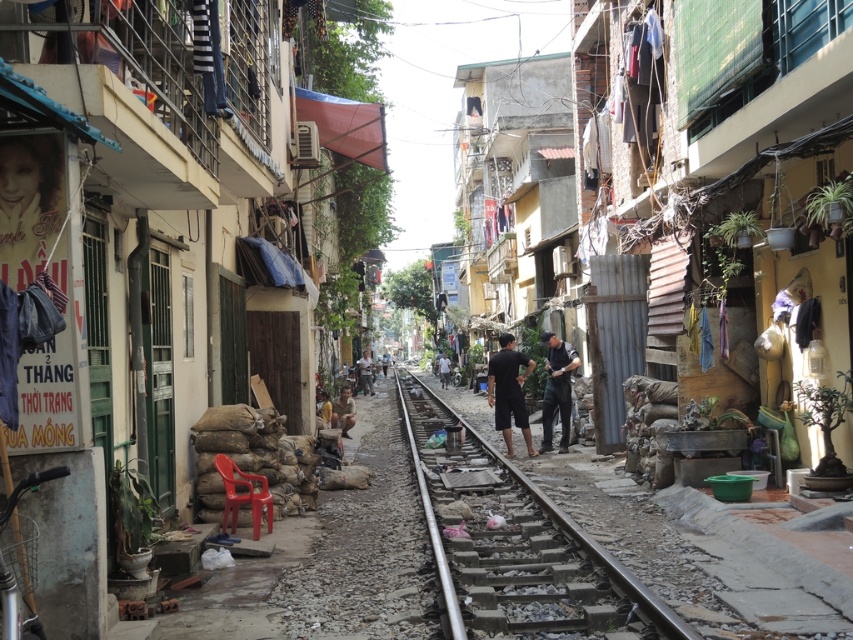
Question: Does dark blue fabric at center appear over red plastic chair at lower left?

Choices:
 (A) yes
 (B) no

Answer: (A)

Question: Among these points, which one is farthest from the camera?

Choices:
 (A) (229, 468)
 (B) (366, 349)
 (C) (553, 365)

Answer: (B)

Question: Which of the following is the farthest from the observer?

Choices:
 (A) (503, 342)
 (B) (227, 502)

Answer: (A)

Question: Considering the relative positions of dark blue fabric at center and brown fabric pants at center in the image provided, where is dark blue fabric at center located with respect to brown fabric pants at center?

Choices:
 (A) right
 (B) left

Answer: (A)

Question: Is black matte shorts at center in front of dark blue fabric at center?

Choices:
 (A) yes
 (B) no

Answer: (A)

Question: Which of the following is the closest to the observer?

Choices:
 (A) red plastic chair at lower left
 (B) metal railway line at center
 (C) dark gray fabric at center

Answer: (B)